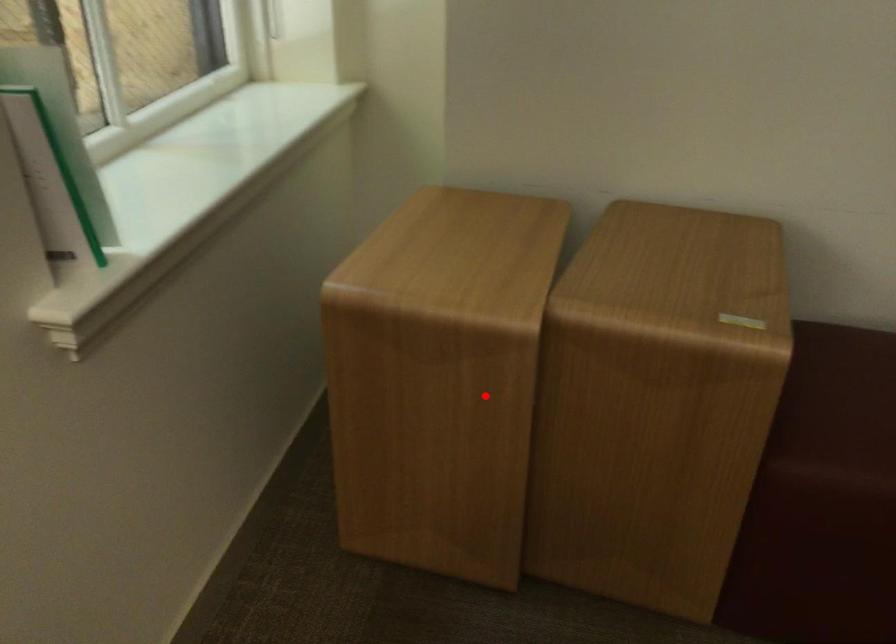
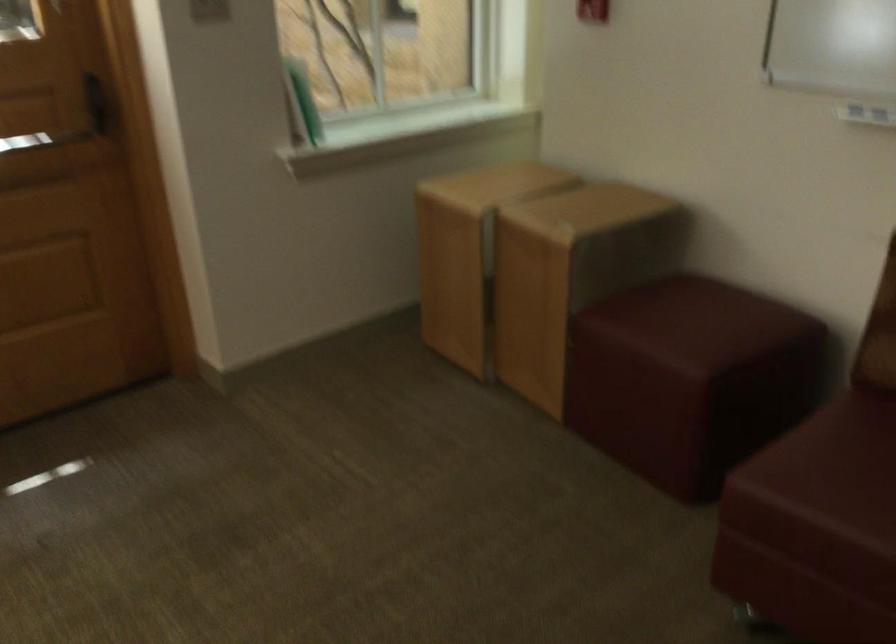
Question: A red point is marked in image1. In image2, is the corresponding 3D point closer to the camera or farther? Reply with the corresponding letter.

Choices:
 (A) The corresponding 3D point is closer.
 (B) The corresponding 3D point is farther.

Answer: (B)